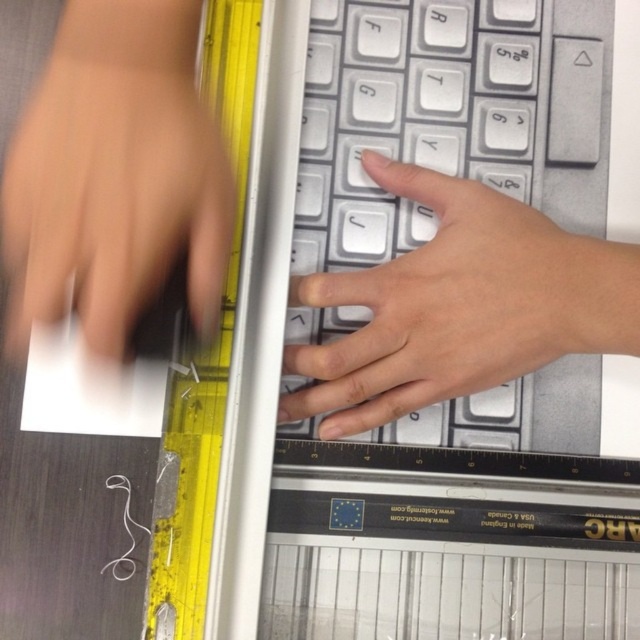
Can you confirm if white matte hand at center is positioned below yellow plastic ruler at left?

Correct, white matte hand at center is located below yellow plastic ruler at left.

Is white matte hand at center above yellow plastic ruler at left?

No.

Who is more forward, (554, 346) or (227, 332)?

Point (554, 346)

Identify the location of white matte hand at center. (444, 307).

Is point (88, 124) less distant than point (218, 84)?

Yes, point (88, 124) is in front of point (218, 84).

What do you see at coordinates (113, 196) in the screenshot? The image size is (640, 640). I see `matte black hand at left` at bounding box center [113, 196].

The image size is (640, 640). I want to click on matte black hand at left, so 113,196.

Can you confirm if matte black hand at left is positioned above white matte hand at center?

Correct, matte black hand at left is located above white matte hand at center.

Is point (64, 301) farther from viewer compared to point (413, 365)?

No, (64, 301) is closer to viewer.

Image resolution: width=640 pixels, height=640 pixels. In order to click on matte black hand at left in this screenshot , I will do `click(113, 196)`.